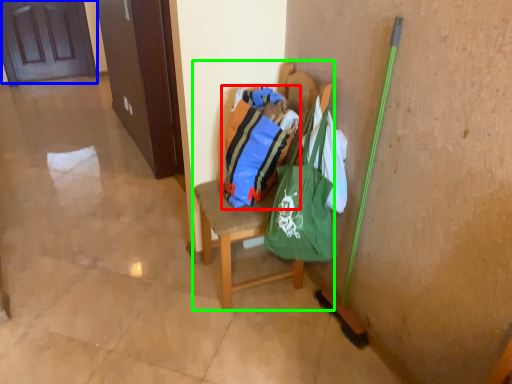
Question: Which object is the farthest from shopping bag (highlighted by a red box)? Choose among these: door (highlighted by a blue box) or chair (highlighted by a green box).

Choices:
 (A) door
 (B) chair

Answer: (A)